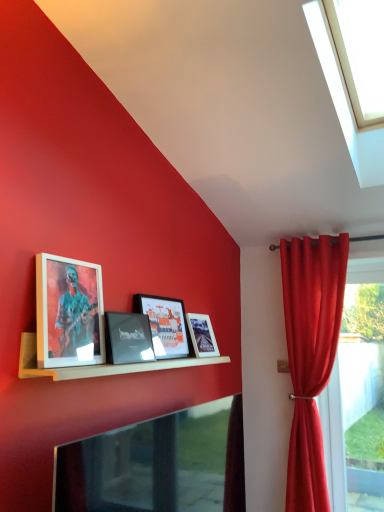
Question: From a real-world perspective, is matte glass picture frame at center, marked as the third picture frame in a front-to-back arrangement, physically below matte black picture frame at center, which is the 2th picture frame from front to back?

Choices:
 (A) yes
 (B) no

Answer: (B)

Question: Does matte glass picture frame at center, which is the second picture frame from back to front, have a lesser height compared to matte black picture frame at center, which is the 2th picture frame from front to back?

Choices:
 (A) yes
 (B) no

Answer: (B)

Question: Does matte glass picture frame at center, marked as the third picture frame in a front-to-back arrangement, appear on the right side of matte black picture frame at center, which is the 2th picture frame from front to back?

Choices:
 (A) yes
 (B) no

Answer: (A)

Question: Considering the relative sizes of matte glass picture frame at center, marked as the third picture frame in a front-to-back arrangement, and matte black picture frame at center, which is the 2th picture frame from front to back, in the image provided, is matte glass picture frame at center, marked as the third picture frame in a front-to-back arrangement, bigger than matte black picture frame at center, which is the 2th picture frame from front to back,?

Choices:
 (A) yes
 (B) no

Answer: (A)

Question: Does matte glass picture frame at center, which is the second picture frame from back to front, contain matte black picture frame at center, the third picture frame from the back?

Choices:
 (A) no
 (B) yes

Answer: (A)

Question: Can you confirm if matte glass picture frame at center, which is the second picture frame from back to front, is taller than matte black picture frame at center, which is the 2th picture frame from front to back?

Choices:
 (A) yes
 (B) no

Answer: (A)

Question: Is wooden framed picture at upper left, the first picture frame positioned from the front, in contact with transparent glass window at upper right?

Choices:
 (A) yes
 (B) no

Answer: (B)

Question: From the image's perspective, does wooden framed picture at upper left, placed as the 4th picture frame when sorted from back to front, appear lower than transparent glass window at upper right?

Choices:
 (A) yes
 (B) no

Answer: (A)

Question: Does wooden framed picture at upper left, the first picture frame positioned from the front, have a lesser height compared to transparent glass window at upper right?

Choices:
 (A) no
 (B) yes

Answer: (A)

Question: Are wooden framed picture at upper left, the first picture frame positioned from the front, and transparent glass window at upper right located far from each other?

Choices:
 (A) no
 (B) yes

Answer: (B)

Question: Is wooden framed picture at upper left, the first picture frame positioned from the front, turned away from transparent glass window at upper right?

Choices:
 (A) no
 (B) yes

Answer: (A)

Question: Considering the relative positions of wooden framed picture at upper left, the first picture frame positioned from the front, and transparent glass window at upper right in the image provided, is wooden framed picture at upper left, the first picture frame positioned from the front, to the right of transparent glass window at upper right from the viewer's perspective?

Choices:
 (A) yes
 (B) no

Answer: (B)

Question: Is matte glass picture frame at center, which is the second picture frame from back to front, at the back of transparent glass window at upper right?

Choices:
 (A) yes
 (B) no

Answer: (B)